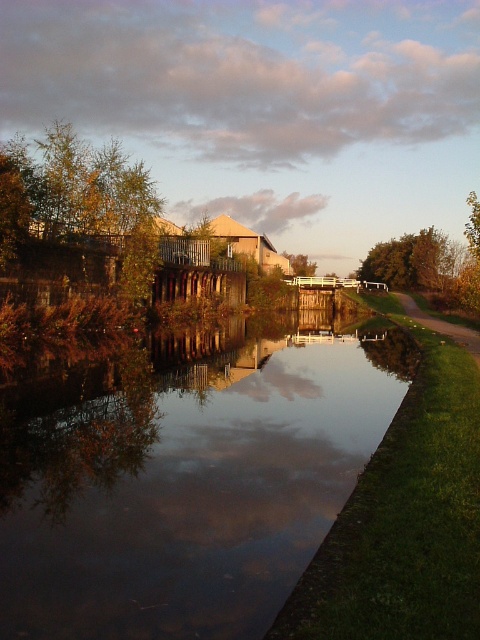
You are standing at the point marked by coordinates point (183, 481) in the canal scene. Looking around, you see smooth reflective water at center and other structures. Which direction should you move to reach the small bridge with white railing spanning the canal?

The smooth reflective water at center is located at point (183, 481). To reach the small bridge with white railing spanning the canal, you should move towards the lower part of the canal since the bridge is positioned further down from the center.

You are standing at the edge of the canal and want to place a small floating lantern on the smooth reflective water at center. According to the coordinates provided, is the water surface at the correct position to place the lantern?

The smooth reflective water at center is located at point (183,481), so yes, the coordinates indicate that the water surface is at the correct position to place the lantern there.

You are standing on the grassy dirt path at lower right and want to take a photo of the green leafy tree at right. Since the tree is taller than the path, where should you position yourself to ensure the entire tree fits in your camera frame?

Since the green leafy tree at right is taller than the grassy dirt path at lower right, you should position yourself further away from the tree to ensure the entire tree fits in your camera frame.